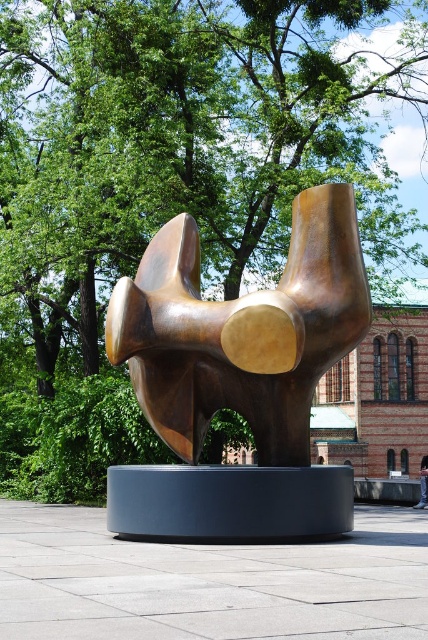
How far apart are bronze sculpture at center and denim pants at lower right?

bronze sculpture at center is 10.56 meters away from denim pants at lower right.

Can you confirm if bronze sculpture at center is positioned above denim pants at lower right?

Yes.

Which is in front, point (234, 353) or point (425, 474)?

Point (234, 353)

Locate an element on the screen. bronze sculpture at center is located at coordinates (238, 378).